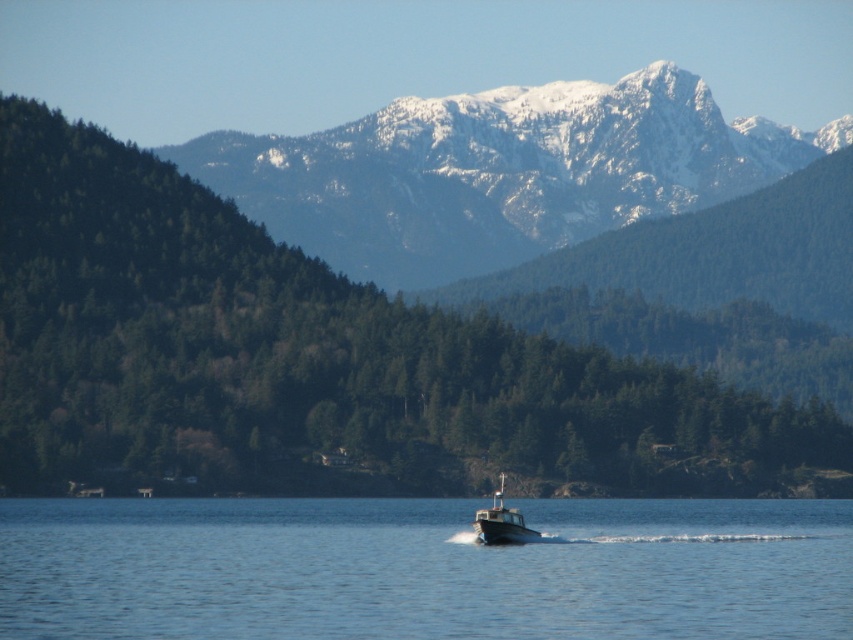
Does blue water at center have a larger size compared to snowy rocky mountain range at upper center?

No, blue water at center is not bigger than snowy rocky mountain range at upper center.

The image size is (853, 640). What do you see at coordinates (422, 568) in the screenshot? I see `blue water at center` at bounding box center [422, 568].

The image size is (853, 640). I want to click on blue water at center, so click(422, 568).

Who is positioned more to the right, green matte tree at center or white plastic boat at center?

white plastic boat at center

In the scene shown: Can you confirm if green matte tree at center is bigger than white plastic boat at center?

Yes.

Locate an element on the screen. The width and height of the screenshot is (853, 640). green matte tree at center is located at coordinates click(x=316, y=364).

Does green matte tree at center have a greater width compared to blue water at center?

Correct, the width of green matte tree at center exceeds that of blue water at center.

At what (x,y) coordinates should I click in order to perform the action: click on green matte tree at center. Please return your answer as a coordinate pair (x, y). The width and height of the screenshot is (853, 640). Looking at the image, I should click on (316, 364).

Image resolution: width=853 pixels, height=640 pixels. Find the location of `green matte tree at center`. green matte tree at center is located at coordinates (316, 364).